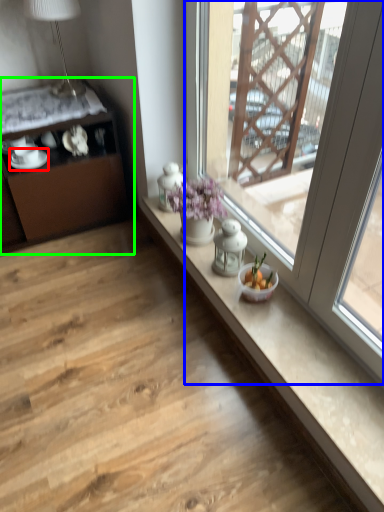
Question: Which object is positioned closest to tableware (highlighted by a red box)? Select from window (highlighted by a blue box) and cabinetry (highlighted by a green box).

Choices:
 (A) window
 (B) cabinetry

Answer: (B)